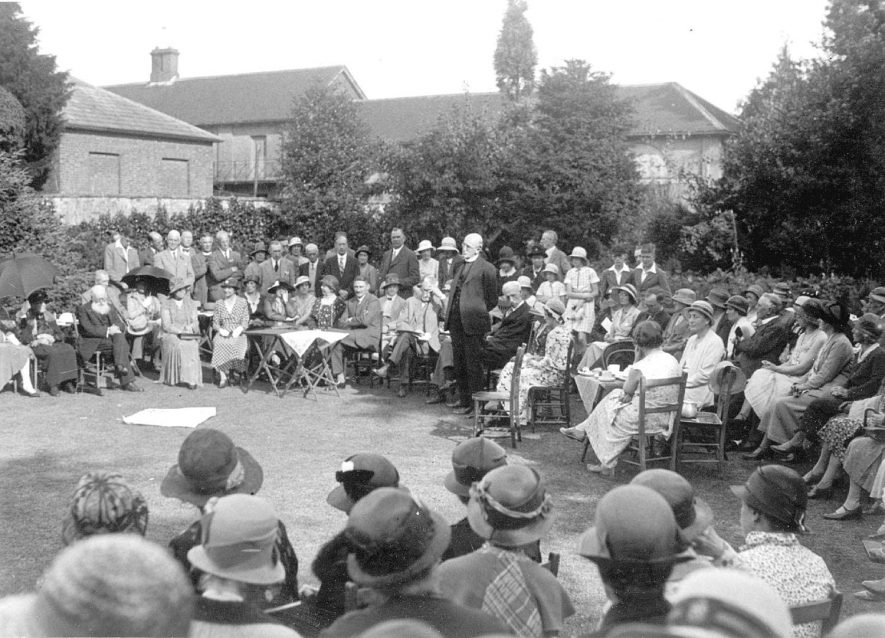
What are the coordinates of `chimney` in the screenshot? It's located at (167, 73).